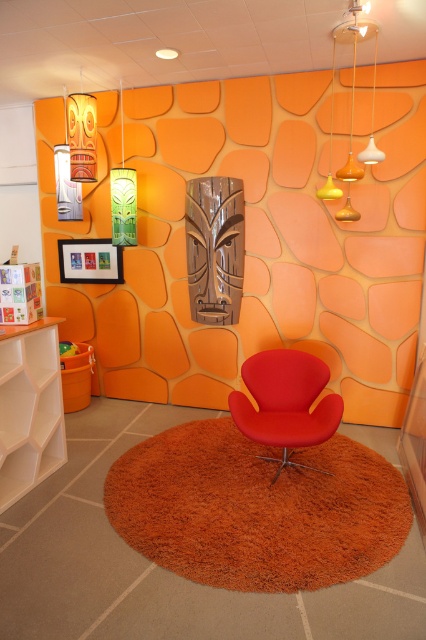
Based on the photo, is green fabric lampshade at upper left closer to camera compared to metallic silver lampshade at upper left?

Yes, it is.

Can you confirm if green fabric lampshade at upper left is positioned to the right of metallic silver lampshade at upper left?

Indeed, green fabric lampshade at upper left is positioned on the right side of metallic silver lampshade at upper left.

Measure the distance between point [132,221] and camera.

Point [132,221] is 12.95 feet from camera.

You are a GUI agent. You are given a task and a screenshot of the screen. Output one action in this format:
    pyautogui.click(x=<x>, y=<y>)
    Task: Click on the green fabric lampshade at upper left
    This screenshot has height=640, width=426.
    Given the screenshot: What is the action you would take?
    pyautogui.click(x=123, y=196)

Which is in front, point (354, 214) or point (134, 184)?

Point (354, 214) is more forward.

Between point (359, 8) and point (117, 232), which one is positioned behind?

The point (117, 232) is behind.

The height and width of the screenshot is (640, 426). What are the coordinates of `matte orange pendant light at upper right` in the screenshot? It's located at (351, 113).

Who is lower down, green fabric lampshade at upper left or white glossy pendant light at upper right?

green fabric lampshade at upper left is lower down.

From the picture: Is green fabric lampshade at upper left shorter than white glossy pendant light at upper right?

In fact, green fabric lampshade at upper left may be taller than white glossy pendant light at upper right.

You are a GUI agent. You are given a task and a screenshot of the screen. Output one action in this format:
    pyautogui.click(x=<x>, y=<y>)
    Task: Click on the green fabric lampshade at upper left
    The height and width of the screenshot is (640, 426).
    Given the screenshot: What is the action you would take?
    pyautogui.click(x=123, y=196)